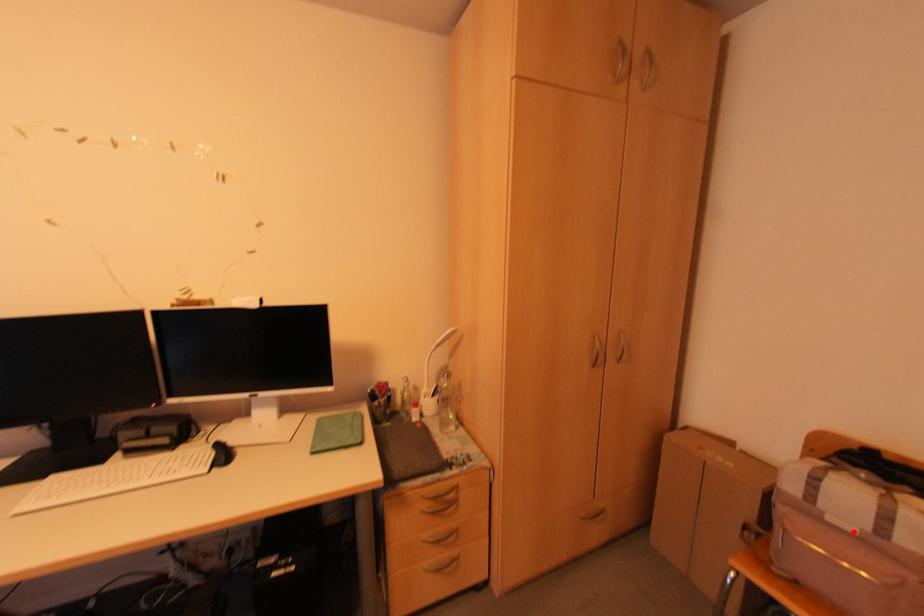
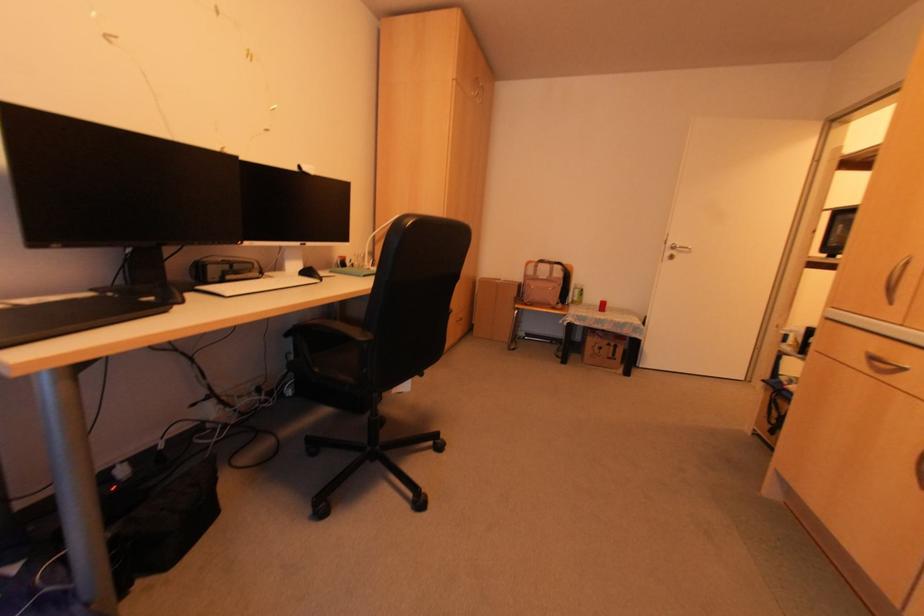
Find the pixel in the second image that matches the highlighted location in the first image.

(542, 278)